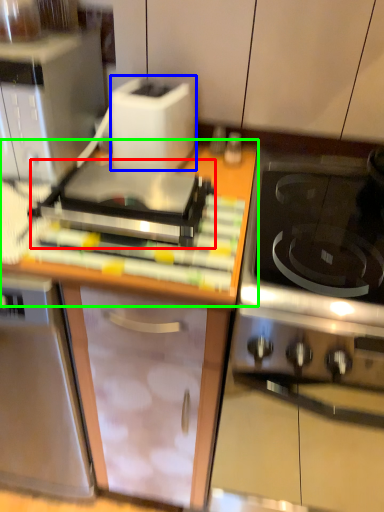
Question: Based on their relative distances, which object is nearer to appliance (highlighted by a red box)? Choose from toaster (highlighted by a blue box) and countertop (highlighted by a green box).

Choices:
 (A) toaster
 (B) countertop

Answer: (B)